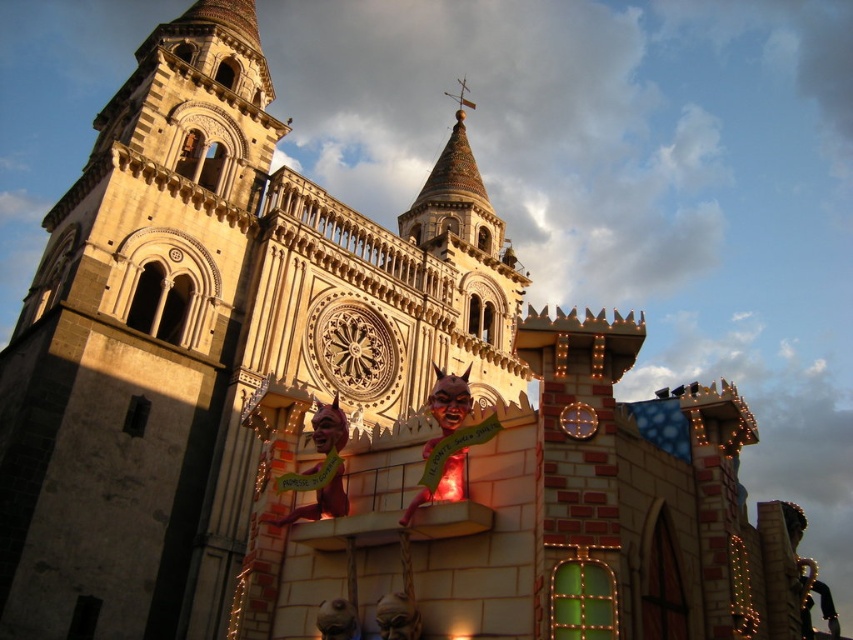
You are an architect assessing the structural integrity of the beige stone tower at center and the metallic gold clock at center. Based on their positions, which one is located higher in the image?

The beige stone tower at center is above the metallic gold clock at center, so it is higher in the image.